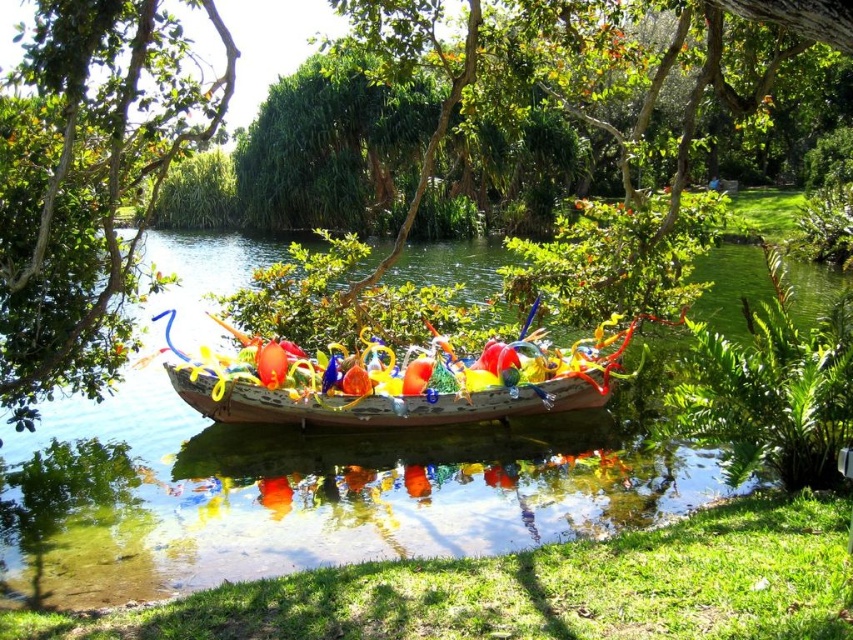
Question: Among these points, which one is nearest to the camera?

Choices:
 (A) (84, 182)
 (B) (271, 417)
 (C) (163, 164)

Answer: (A)

Question: Can you confirm if green leafy tree at left is positioned to the right of translucent glass boat at center?

Choices:
 (A) no
 (B) yes

Answer: (A)

Question: Is the position of green leafy tree at center less distant than that of translucent glass boat at center?

Choices:
 (A) yes
 (B) no

Answer: (A)

Question: Which of the following is the closest to the observer?

Choices:
 (A) (215, 385)
 (B) (109, 198)

Answer: (B)

Question: Can you confirm if green leafy tree at center is thinner than translucent glass boat at center?

Choices:
 (A) no
 (B) yes

Answer: (A)

Question: Among these objects, which one is nearest to the camera?

Choices:
 (A) green leafy tree at center
 (B) green leafy tree at left
 (C) translucent glass boat at center

Answer: (A)